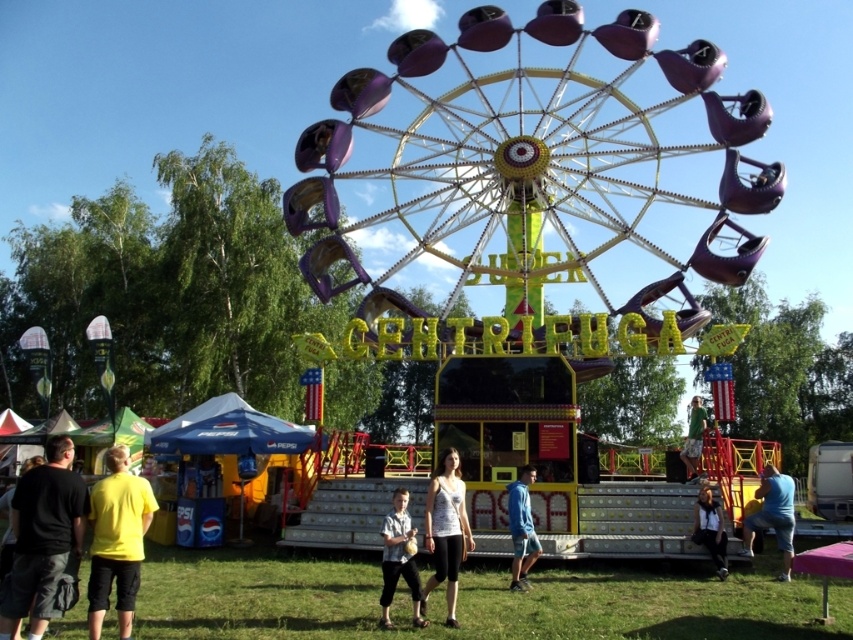
Question: Can you confirm if yellow matte shirt at lower left is smaller than light blue shirt at center?

Choices:
 (A) no
 (B) yes

Answer: (A)

Question: Does metallic purple ferris wheel at center have a larger size compared to blue cotton shirt at center?

Choices:
 (A) no
 (B) yes

Answer: (B)

Question: Which object is farther from the camera taking this photo?

Choices:
 (A) white cotton shirt at lower right
 (B) black cotton shirt at lower left
 (C) yellow matte shirt at lower left

Answer: (A)

Question: Can you confirm if blue cotton shirt at center is wider than white cotton shirt at lower right?

Choices:
 (A) yes
 (B) no

Answer: (A)

Question: Which of these objects is positioned closest to the blue cotton shirt at center?

Choices:
 (A) metallic purple ferris wheel at center
 (B) light blue shirt at center
 (C) green fabric shirt at center

Answer: (C)

Question: Estimate the real-world distances between objects in this image. Which object is farther from the blue cotton shirt at center?

Choices:
 (A) light blue shirt at center
 (B) green fabric shirt at center
 (C) white cotton shirt at lower right

Answer: (A)